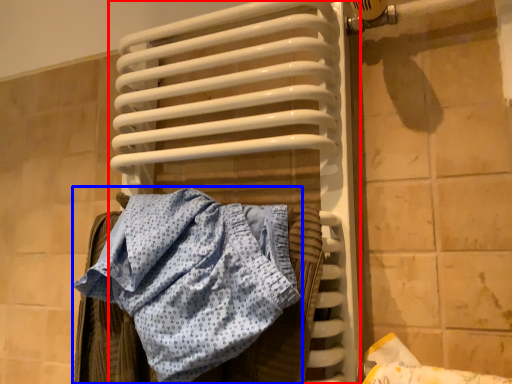
Question: Which object appears closest to the camera in this image, radiator (highlighted by a red box) or towel (highlighted by a blue box)?

Choices:
 (A) radiator
 (B) towel

Answer: (B)